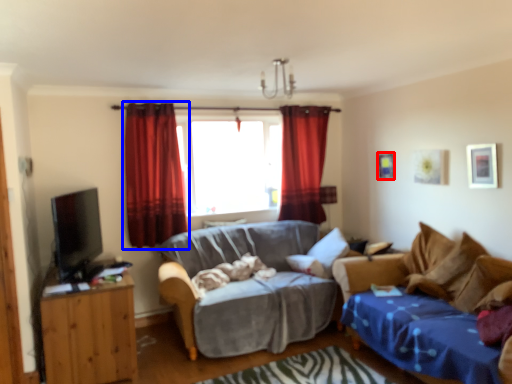
Question: Among these objects, which one is farthest to the camera, picture frame (highlighted by a red box) or curtain (highlighted by a blue box)?

Choices:
 (A) picture frame
 (B) curtain

Answer: (A)